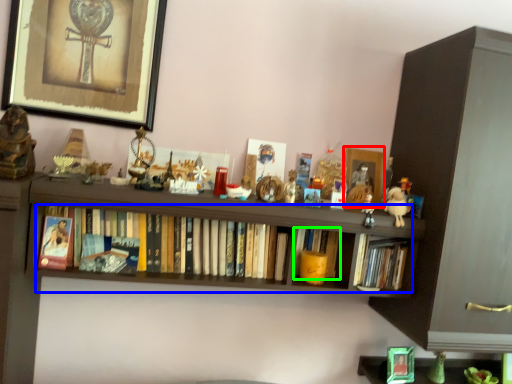
Question: Which is nearer to the picture frame (highlighted by a red box)? book (highlighted by a blue box) or book (highlighted by a green box).

Choices:
 (A) book
 (B) book

Answer: (B)